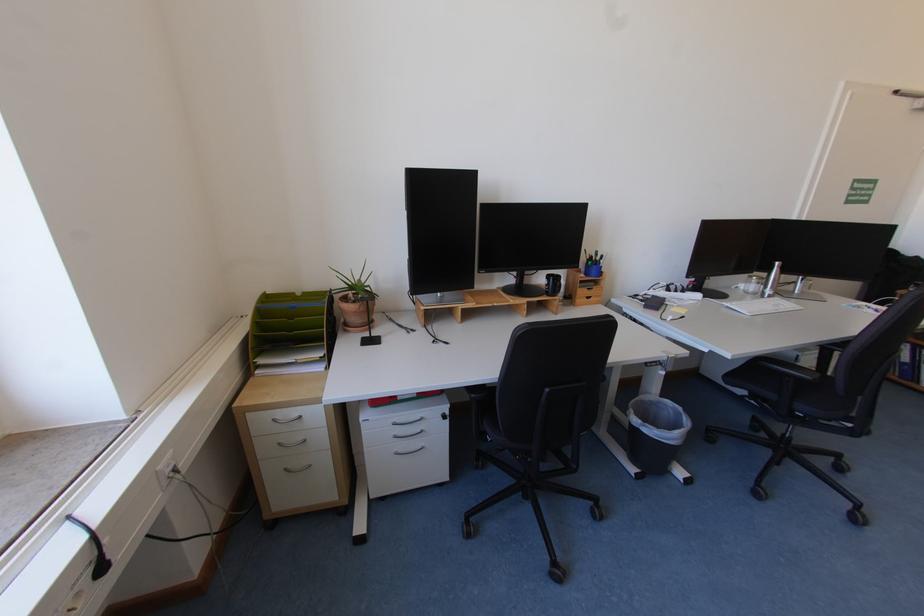
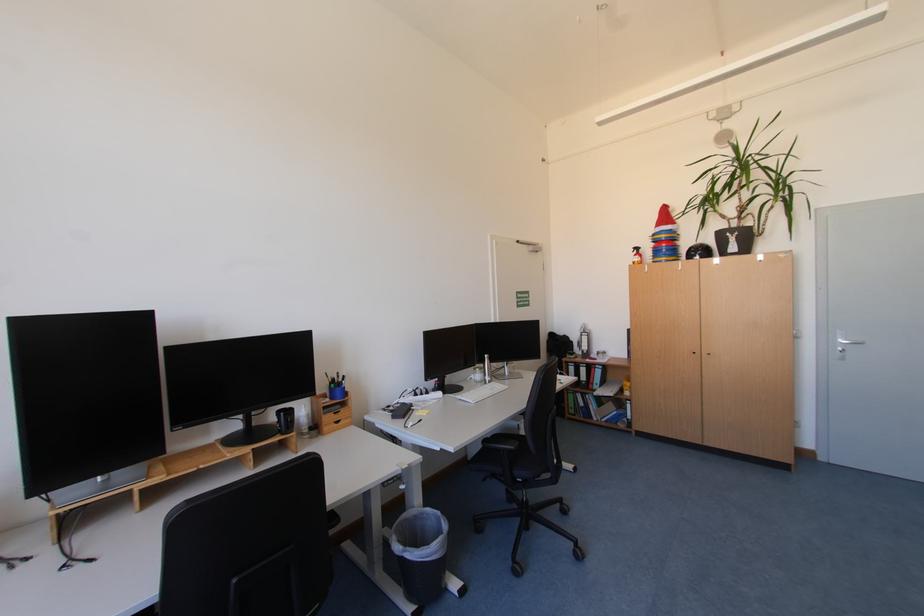
In the second image, find the point that corresponds to pixel 548 278 in the first image.

(277, 416)